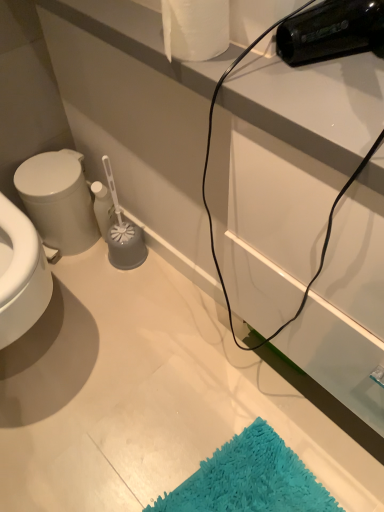
This screenshot has height=512, width=384. What do you see at coordinates (195, 28) in the screenshot?
I see `white matte toilet paper at upper center` at bounding box center [195, 28].

Where is `white matte toilet paper at upper center`? Image resolution: width=384 pixels, height=512 pixels. white matte toilet paper at upper center is located at coordinates (195, 28).

This screenshot has height=512, width=384. What do you see at coordinates (58, 201) in the screenshot?
I see `white glossy bidet at left` at bounding box center [58, 201].

Locate an element on the screen. white glossy bidet at left is located at coordinates (58, 201).

Identify the location of white matte toilet paper at upper center. The image size is (384, 512). (195, 28).

Which object is positioned more to the right, white glossy bidet at left or white matte toilet paper at upper center?

white matte toilet paper at upper center.

Relative to white matte toilet paper at upper center, is white glossy bidet at left in front or behind?

In the image, white glossy bidet at left appears behind white matte toilet paper at upper center.

Considering the positions of points (69, 234) and (210, 12), is point (69, 234) farther from camera compared to point (210, 12)?

Yes, point (69, 234) is farther from viewer.

From the image's perspective, which object appears higher, white glossy bidet at left or white matte toilet paper at upper center?

white matte toilet paper at upper center appears higher in the image.

From a real-world perspective, between white glossy bidet at left and white matte toilet paper at upper center, who is vertically lower?

white glossy bidet at left.

Which object is thinner, white glossy bidet at left or white matte toilet paper at upper center?

white matte toilet paper at upper center.

Is white glossy bidet at left taller than white matte toilet paper at upper center?

Yes.

Does white glossy bidet at left have a larger size compared to white matte toilet paper at upper center?

Yes.

Is white glossy bidet at left situated inside white matte toilet paper at upper center or outside?

white glossy bidet at left exists outside the volume of white matte toilet paper at upper center.

Is white glossy bidet at left beside white matte toilet paper at upper center?

white glossy bidet at left and white matte toilet paper at upper center are not in contact.

Is white glossy bidet at left facing towards white matte toilet paper at upper center?

No.

In the scene shown: What's the angular difference between white glossy bidet at left and white matte toilet paper at upper center's facing directions?

They differ by 90 degrees in their facing directions.

How much distance is there between white glossy bidet at left and white matte toilet paper at upper center?

77.44 centimeters.

Where is `bidet lying behind the white matte toilet paper at upper center`? The width and height of the screenshot is (384, 512). bidet lying behind the white matte toilet paper at upper center is located at coordinates (58, 201).

Can you confirm if white matte toilet paper at upper center is positioned to the left of white glossy bidet at left?

Incorrect, white matte toilet paper at upper center is not on the left side of white glossy bidet at left.

Is white matte toilet paper at upper center in front of or behind white glossy bidet at left in the image?

white matte toilet paper at upper center is in front of white glossy bidet at left.

Is point (162, 5) farther from viewer compared to point (31, 200)?

That is False.

From the image's perspective, which one is positioned lower, white matte toilet paper at upper center or white glossy bidet at left?

white glossy bidet at left is shown below in the image.

From a real-world perspective, between white matte toilet paper at upper center and white glossy bidet at left, who is vertically lower?

white glossy bidet at left.

Considering the sizes of objects white matte toilet paper at upper center and white glossy bidet at left in the image provided, who is thinner, white matte toilet paper at upper center or white glossy bidet at left?

white matte toilet paper at upper center.

Considering the relative sizes of white matte toilet paper at upper center and white glossy bidet at left in the image provided, is white matte toilet paper at upper center shorter than white glossy bidet at left?

Indeed, white matte toilet paper at upper center has a lesser height compared to white glossy bidet at left.

Based on the photo, considering the sizes of objects white matte toilet paper at upper center and white glossy bidet at left in the image provided, who is smaller, white matte toilet paper at upper center or white glossy bidet at left?

With smaller size is white matte toilet paper at upper center.

Is white matte toilet paper at upper center inside the boundaries of white glossy bidet at left, or outside?

white matte toilet paper at upper center lies outside white glossy bidet at left.

Is white matte toilet paper at upper center not close to white glossy bidet at left?

That's not correct — white matte toilet paper at upper center is a little close to white glossy bidet at left.

Consider the image. Is white matte toilet paper at upper center aimed at white glossy bidet at left?

No, white matte toilet paper at upper center is not oriented towards white glossy bidet at left.

At what (x,y) coordinates should I click in order to perform the action: click on bidet below the white matte toilet paper at upper center (from a real-world perspective). Please return your answer as a coordinate pair (x, y). Looking at the image, I should click on (58, 201).

The image size is (384, 512). I want to click on bidet located behind the white matte toilet paper at upper center, so click(x=58, y=201).

Identify the location of toilet paper above the white glossy bidet at left (from the image's perspective). (195, 28).